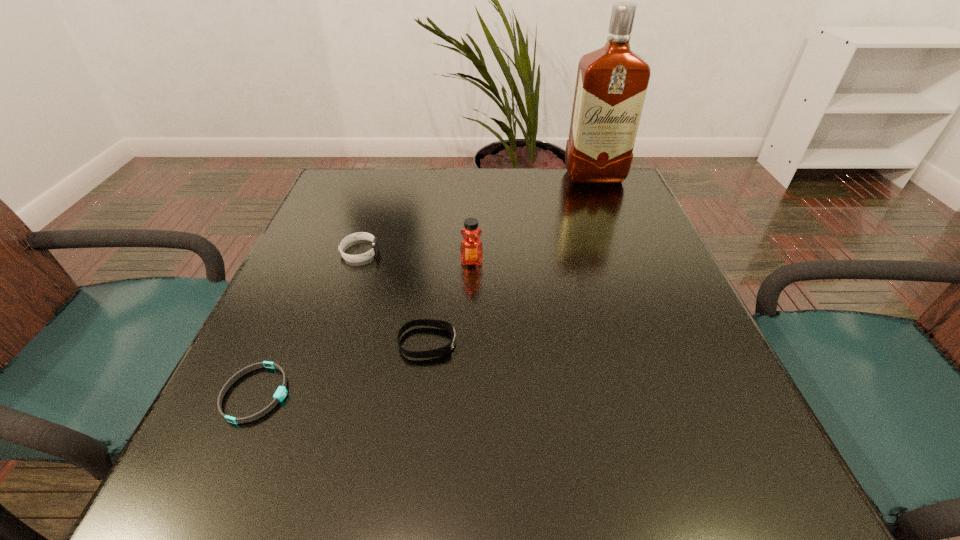
The height and width of the screenshot is (540, 960). Identify the location of vacant space located on the front label of the farthest object. (623, 249).

Where is `free space located 0.230m on the front label of the honey`? This screenshot has width=960, height=540. free space located 0.230m on the front label of the honey is located at coordinates (469, 354).

Find the location of a particular element. free space located on the outer surface of the third tallest object is located at coordinates (415, 253).

Identify the location of vacant space located 0.350m on the display of the rightmost wristband. This screenshot has height=540, width=960. 656,342.

Identify the location of vacant space situated 0.230m on the buckle of the nearest object. This screenshot has width=960, height=540. (435, 394).

Identify the location of object that is at the far edge. This screenshot has height=540, width=960. (611, 85).

Where is `object that is positioned at the right edge`? Image resolution: width=960 pixels, height=540 pixels. object that is positioned at the right edge is located at coordinates (611, 85).

The image size is (960, 540). I want to click on object at the far right corner, so click(x=611, y=85).

What are the coordinates of `vacant space at the far edge` in the screenshot? It's located at (451, 173).

You are a GUI agent. You are given a task and a screenshot of the screen. Output one action in this format:
    pyautogui.click(x=<x>, y=<y>)
    Task: Click on the free location at the near edge
    
    Given the screenshot: What is the action you would take?
    pyautogui.click(x=504, y=457)